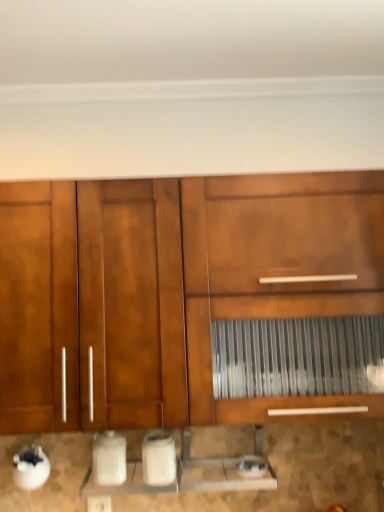
Question: Is matte wood cabinet at center inside the boundaries of satin silver toaster at lower center, which is the 3th appliance from left to right, or outside?

Choices:
 (A) outside
 (B) inside

Answer: (A)

Question: In the image, is matte wood cabinet at center positioned in front of or behind satin silver toaster at lower center, which is counted as the 1th appliance, starting from the right?

Choices:
 (A) front
 (B) behind

Answer: (A)

Question: Estimate the real-world distances between objects in this image. Which object is farther from the satin silver toaster at lower center, which is the 3th appliance from left to right?

Choices:
 (A) white glossy toaster at lower center, which is counted as the second appliance, starting from the right
 (B) white plastic electric outlet at lower center
 (C) white glossy container at lower left, acting as the 3th appliance starting from the right
 (D) matte wood cabinet at center

Answer: (D)

Question: Which is nearer to the matte wood cabinet at center?

Choices:
 (A) satin silver toaster at lower center, which is the 3th appliance from left to right
 (B) white glossy toaster at lower center, which appears as the 2th appliance when viewed from the left
 (C) white glossy container at lower left, acting as the 3th appliance starting from the right
 (D) white plastic electric outlet at lower center

Answer: (B)